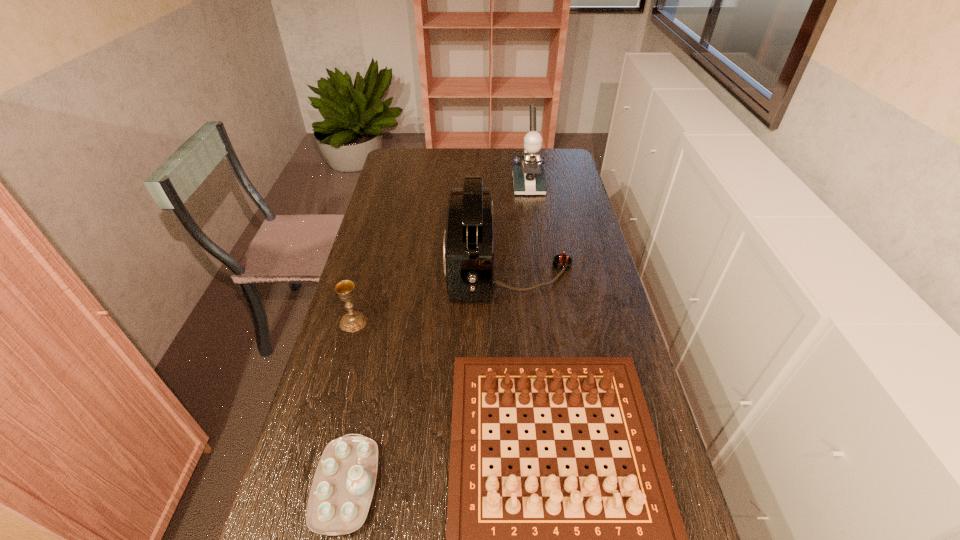
At what (x,y) coordinates should I click in order to perform the action: click on microscope. Please return your answer as a coordinate pair (x, y). The height and width of the screenshot is (540, 960). Looking at the image, I should click on (528, 177).

You are a GUI agent. You are given a task and a screenshot of the screen. Output one action in this format:
    pyautogui.click(x=<x>, y=<y>)
    Task: Click on the fourth nearest object
    
    Given the screenshot: What is the action you would take?
    pyautogui.click(x=468, y=245)

This screenshot has width=960, height=540. I want to click on the third tallest object, so click(353, 321).

This screenshot has height=540, width=960. Identify the location of chalice. (353, 321).

The width and height of the screenshot is (960, 540). What are the coordinates of `chinaware` in the screenshot? It's located at (341, 493).

At what (x,y) coordinates should I click in order to perform the action: click on vacant space located at the eyepiece of the microscope. Please return your answer as a coordinate pair (x, y). The image size is (960, 540). Looking at the image, I should click on (536, 235).

Where is `vacant region located 0.120m on the front-facing side of the fourth nearest object`? vacant region located 0.120m on the front-facing side of the fourth nearest object is located at coordinates click(x=410, y=267).

Where is `vacant space situated 0.220m on the front-facing side of the fourth nearest object`? vacant space situated 0.220m on the front-facing side of the fourth nearest object is located at coordinates pos(379,267).

In order to click on vacant space situated 0.130m on the front-facing side of the fourth nearest object in this screenshot , I will do `click(407, 267)`.

Find the location of `free space located 0.290m on the back of the third tallest object`. free space located 0.290m on the back of the third tallest object is located at coordinates (373, 249).